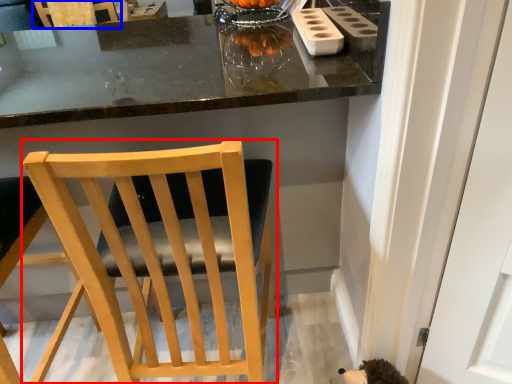
Question: Which object appears closest to the camera in this image, chair (highlighted by a red box) or chair (highlighted by a blue box)?

Choices:
 (A) chair
 (B) chair

Answer: (A)